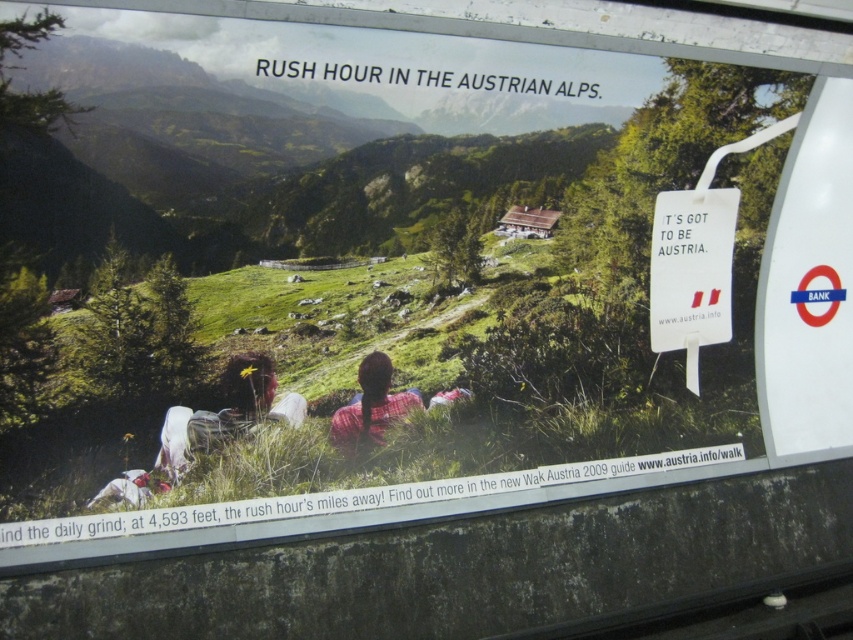
Does matte black backpack at center appear over plaid shirt at center?

Yes, matte black backpack at center is above plaid shirt at center.

Is point (262, 355) less distant than point (347, 410)?

Yes, it is.

Identify the location of matte black backpack at center. The height and width of the screenshot is (640, 853). (225, 413).